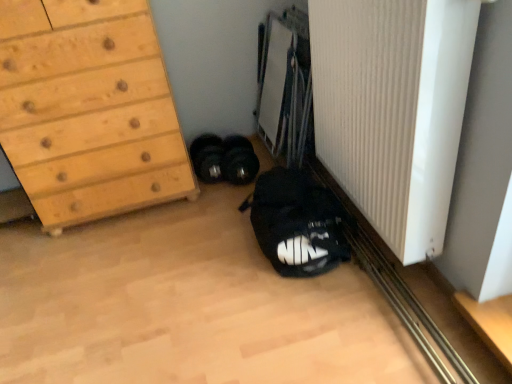
Find the location of `vacant space in between wooden chest of drawers at left and black fabric backpack at lower center`. vacant space in between wooden chest of drawers at left and black fabric backpack at lower center is located at coordinates (179, 233).